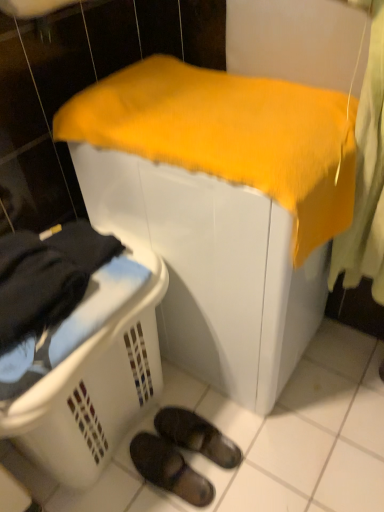
This screenshot has width=384, height=512. Identify the location of free space in front of yellow fabric-covered object at center. (279, 446).